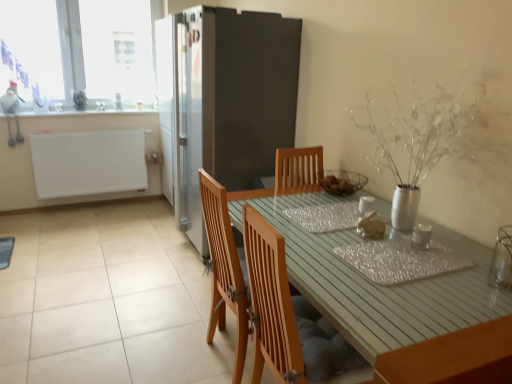
Question: Is white glossy counter top at upper left shorter than satin silver fridge at center?

Choices:
 (A) no
 (B) yes

Answer: (B)

Question: From a real-world perspective, is white glossy counter top at upper left positioned over satin silver fridge at center based on gravity?

Choices:
 (A) yes
 (B) no

Answer: (A)

Question: Can you confirm if white glossy counter top at upper left is positioned to the right of satin silver fridge at center?

Choices:
 (A) yes
 (B) no

Answer: (B)

Question: From a real-world perspective, is white glossy counter top at upper left physically below satin silver fridge at center?

Choices:
 (A) yes
 (B) no

Answer: (B)

Question: From the image's perspective, is white glossy counter top at upper left beneath satin silver fridge at center?

Choices:
 (A) no
 (B) yes

Answer: (A)

Question: Does white glossy counter top at upper left turn towards satin silver fridge at center?

Choices:
 (A) yes
 (B) no

Answer: (A)

Question: Would you say wooden table at center is part of transparent glass window at upper left's contents?

Choices:
 (A) yes
 (B) no

Answer: (B)

Question: Is transparent glass window at upper left closer to the viewer compared to wooden table at center?

Choices:
 (A) yes
 (B) no

Answer: (B)

Question: Considering the relative sizes of transparent glass window at upper left and wooden table at center in the image provided, is transparent glass window at upper left bigger than wooden table at center?

Choices:
 (A) yes
 (B) no

Answer: (B)

Question: From a real-world perspective, is transparent glass window at upper left on wooden table at center?

Choices:
 (A) no
 (B) yes

Answer: (B)

Question: Can you confirm if transparent glass window at upper left is positioned to the right of wooden table at center?

Choices:
 (A) yes
 (B) no

Answer: (B)

Question: Does transparent glass window at upper left have a greater width compared to wooden table at center?

Choices:
 (A) no
 (B) yes

Answer: (A)

Question: Does shiny metallic placemat at center turn towards white glossy counter top at upper left?

Choices:
 (A) yes
 (B) no

Answer: (B)